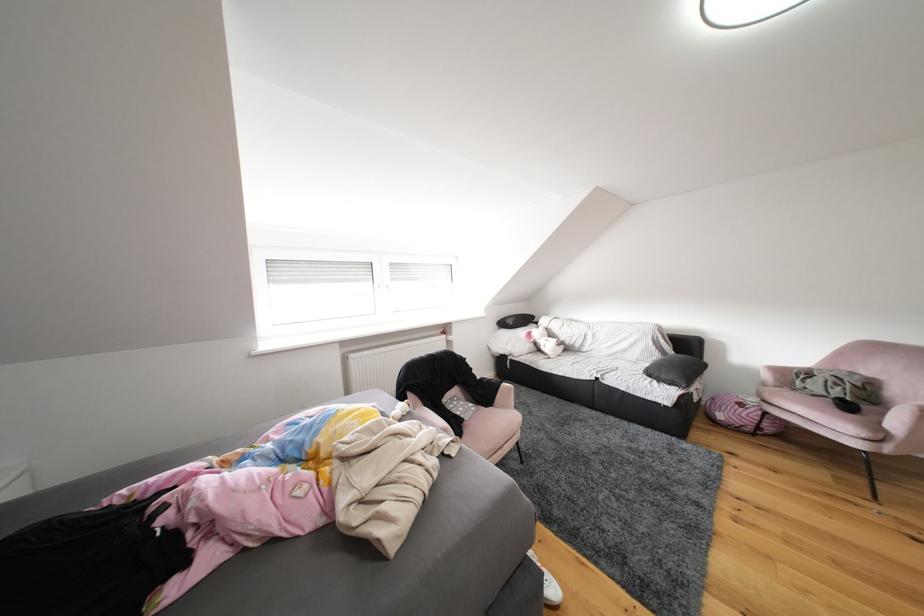
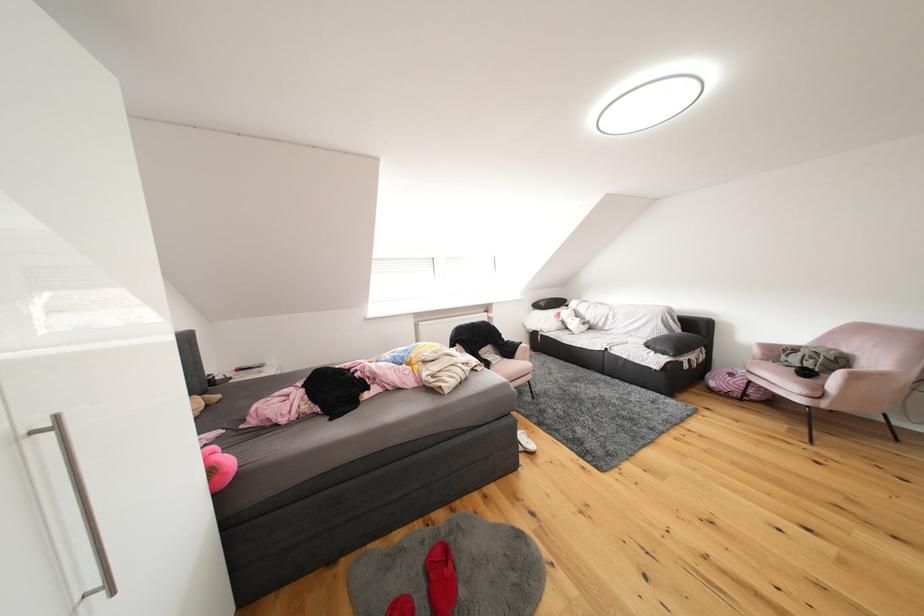
The point at [673,379] is marked in the first image. Where is the corresponding point in the second image?

(667, 351)